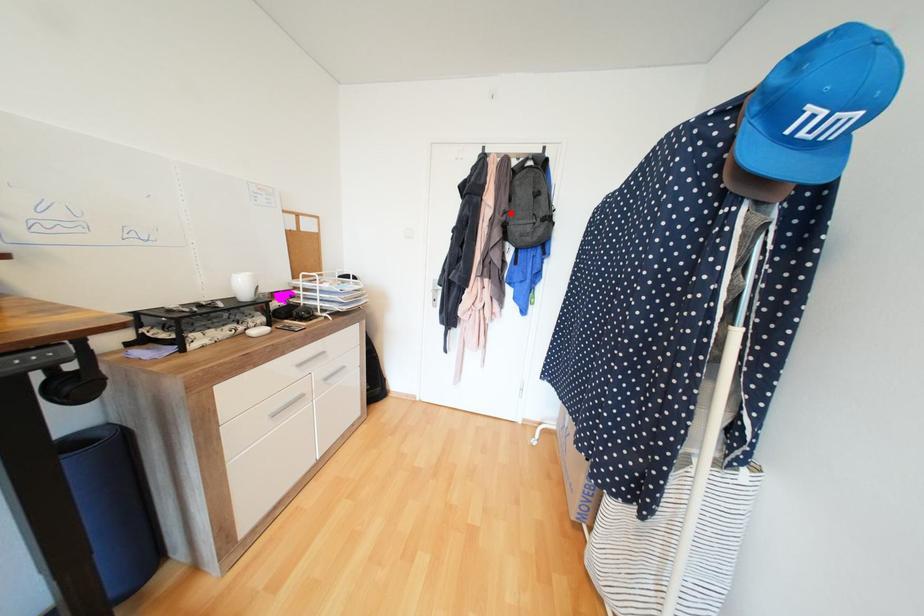
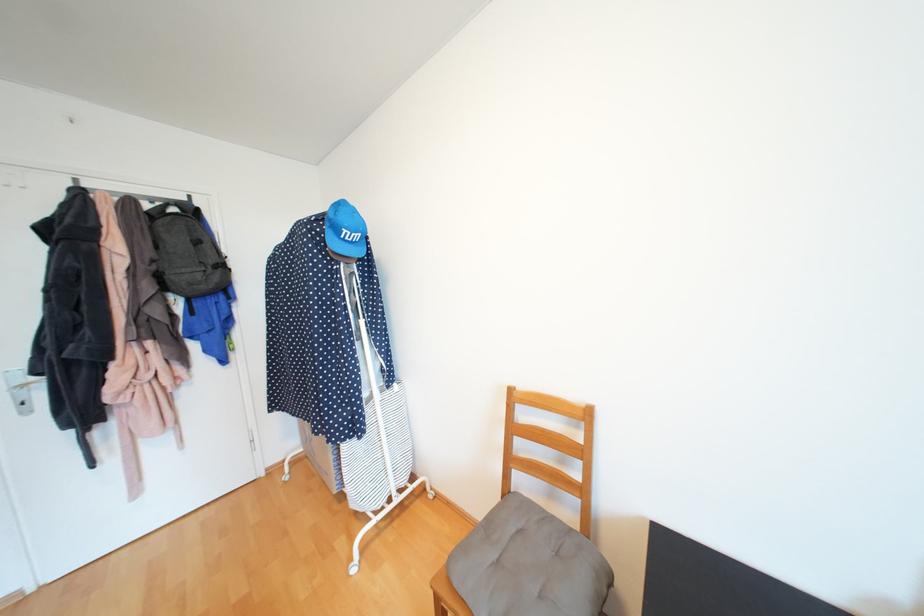
Question: I am providing you with two images of the same scene from different viewpoints. A red point is marked on the first image. Can you still see the location of the red point in image 2?

Choices:
 (A) Yes
 (B) No

Answer: (A)